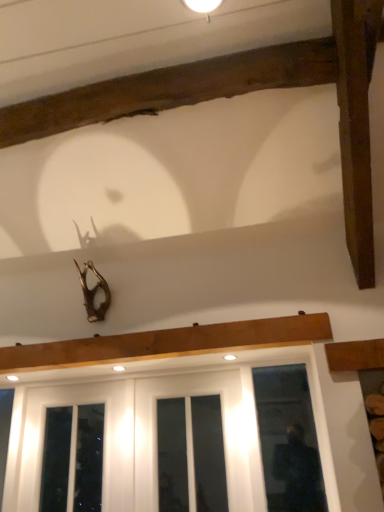
Question: Is white glossy screen door at lower center wider or thinner than clear glass door at lower right, which appears as the 2th window when viewed from the left?

Choices:
 (A) wide
 (B) thin

Answer: (B)

Question: Is white glossy screen door at lower center inside or outside of clear glass door at lower right, positioned as the 1th window in right-to-left order?

Choices:
 (A) inside
 (B) outside

Answer: (B)

Question: Based on their relative distances, which object is nearer to the white glossy wood at lower center, which is counted as the 1th window, starting from the left?

Choices:
 (A) clear glass door at lower right, which appears as the 2th window when viewed from the left
 (B) white matte light fixture at upper center
 (C) white glossy screen door at lower center

Answer: (C)

Question: Estimate the real-world distances between objects in this image. Which object is closer to the white glossy screen door at lower center?

Choices:
 (A) clear glass door at lower right, positioned as the 1th window in right-to-left order
 (B) white glossy wood at lower center, which is the 2th window in right-to-left order
 (C) white matte light fixture at upper center

Answer: (B)